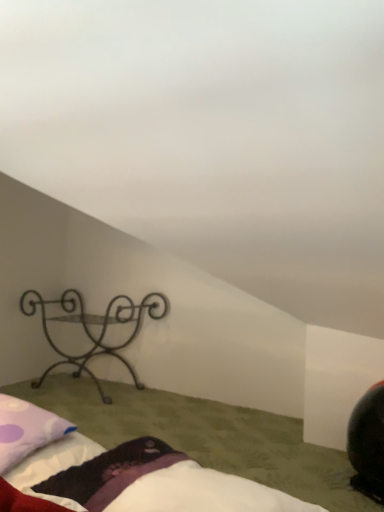
This screenshot has width=384, height=512. What do you see at coordinates (90, 331) in the screenshot?
I see `black wrought iron shelf at left` at bounding box center [90, 331].

Locate an element on the screen. This screenshot has width=384, height=512. black wrought iron shelf at left is located at coordinates (90, 331).

Describe the element at coordinates (140, 480) in the screenshot. Image resolution: width=384 pixels, height=512 pixels. I see `fluffy white bed at lower center` at that location.

Describe the element at coordinates (26, 430) in the screenshot. I see `purple dotted pillow at lower left` at that location.

This screenshot has width=384, height=512. What are the coordinates of `black wrought iron shelf at left` in the screenshot? It's located at (90, 331).

From a real-world perspective, is fluffy white bed at lower center on black wrought iron shelf at left?

No, from a real-world perspective, fluffy white bed at lower center is not on top of black wrought iron shelf at left.

Is fluffy white bed at lower center located outside black wrought iron shelf at left?

Yes, fluffy white bed at lower center is outside of black wrought iron shelf at left.

Identify the location of bed below the black wrought iron shelf at left (from a real-world perspective). (140, 480).

Can purple dotted pillow at lower left be found inside black wrought iron shelf at left?

That's incorrect, purple dotted pillow at lower left is not inside black wrought iron shelf at left.

This screenshot has width=384, height=512. In order to click on furniture that is on the left side of purple dotted pillow at lower left in this screenshot , I will do `click(90, 331)`.

Does black wrought iron shelf at left have a larger size compared to purple dotted pillow at lower left?

Correct, black wrought iron shelf at left is larger in size than purple dotted pillow at lower left.

Which is behind, point (17, 399) or point (6, 457)?

The point (17, 399) is farther.

Does fluffy white bed at lower center come in front of purple dotted pillow at lower left?

Yes, it is in front of purple dotted pillow at lower left.

Looking at the image, does fluffy white bed at lower center seem bigger or smaller compared to purple dotted pillow at lower left?

Considering their sizes, fluffy white bed at lower center takes up more space than purple dotted pillow at lower left.

Image resolution: width=384 pixels, height=512 pixels. Identify the location of bed lying on the right of purple dotted pillow at lower left. (140, 480).

Which object is positioned more to the right, purple dotted pillow at lower left or black wrought iron shelf at left?

From the viewer's perspective, purple dotted pillow at lower left appears more on the right side.

How many degrees apart are the facing directions of purple dotted pillow at lower left and black wrought iron shelf at left?

The angular difference between purple dotted pillow at lower left and black wrought iron shelf at left is 88.9 degrees.

Does purple dotted pillow at lower left turn towards black wrought iron shelf at left?

No, purple dotted pillow at lower left does not turn towards black wrought iron shelf at left.

Locate an element on the screen. The width and height of the screenshot is (384, 512). furniture that appears behind the purple dotted pillow at lower left is located at coordinates (90, 331).

From a real-world perspective, is purple dotted pillow at lower left beneath fluffy white bed at lower center?

Incorrect, from a real-world perspective, purple dotted pillow at lower left is higher than fluffy white bed at lower center.

Which object is wider, purple dotted pillow at lower left or fluffy white bed at lower center?

fluffy white bed at lower center.

Is purple dotted pillow at lower left aimed at fluffy white bed at lower center?

No, purple dotted pillow at lower left is not facing towards fluffy white bed at lower center.

Is fluffy white bed at lower center surrounded by purple dotted pillow at lower left?

No.

Looking at their sizes, would you say black wrought iron shelf at left is wider or thinner than fluffy white bed at lower center?

black wrought iron shelf at left is thinner than fluffy white bed at lower center.

Which is correct: black wrought iron shelf at left is inside fluffy white bed at lower center, or outside of it?

The correct answer is: outside.

Which point is more forward, (74, 319) or (36, 490)?

The point (36, 490) is more forward.

Where is `bed on the right of black wrought iron shelf at left`? The height and width of the screenshot is (512, 384). bed on the right of black wrought iron shelf at left is located at coordinates (140, 480).

At what (x,y) coordinates should I click in order to perform the action: click on furniture that appears above the fluffy white bed at lower center (from the image's perspective). Please return your answer as a coordinate pair (x, y). Looking at the image, I should click on tap(90, 331).

I want to click on pillow that appears above the black wrought iron shelf at left (from a real-world perspective), so click(x=26, y=430).

Estimate the real-world distances between objects in this image. Which object is further from fluffy white bed at lower center, purple dotted pillow at lower left or black wrought iron shelf at left?

Based on the image, black wrought iron shelf at left appears to be further to fluffy white bed at lower center.

When comparing their distances from purple dotted pillow at lower left, does fluffy white bed at lower center or black wrought iron shelf at left seem closer?

fluffy white bed at lower center is positioned closer to the anchor purple dotted pillow at lower left.

Looking at the image, which one is located further to purple dotted pillow at lower left, black wrought iron shelf at left or fluffy white bed at lower center?

black wrought iron shelf at left lies further to purple dotted pillow at lower left than the other object.

Based on their spatial positions, is black wrought iron shelf at left or purple dotted pillow at lower left further from fluffy white bed at lower center?

The object further to fluffy white bed at lower center is black wrought iron shelf at left.

When comparing their distances from black wrought iron shelf at left, does purple dotted pillow at lower left or fluffy white bed at lower center seem closer?

purple dotted pillow at lower left lies closer to black wrought iron shelf at left than the other object.

From the image, which object appears to be farther from black wrought iron shelf at left, fluffy white bed at lower center or purple dotted pillow at lower left?

Based on the image, fluffy white bed at lower center appears to be further to black wrought iron shelf at left.

Where is `pillow between fluffy white bed at lower center and black wrought iron shelf at left from front to back`? This screenshot has height=512, width=384. pillow between fluffy white bed at lower center and black wrought iron shelf at left from front to back is located at coordinates (26, 430).